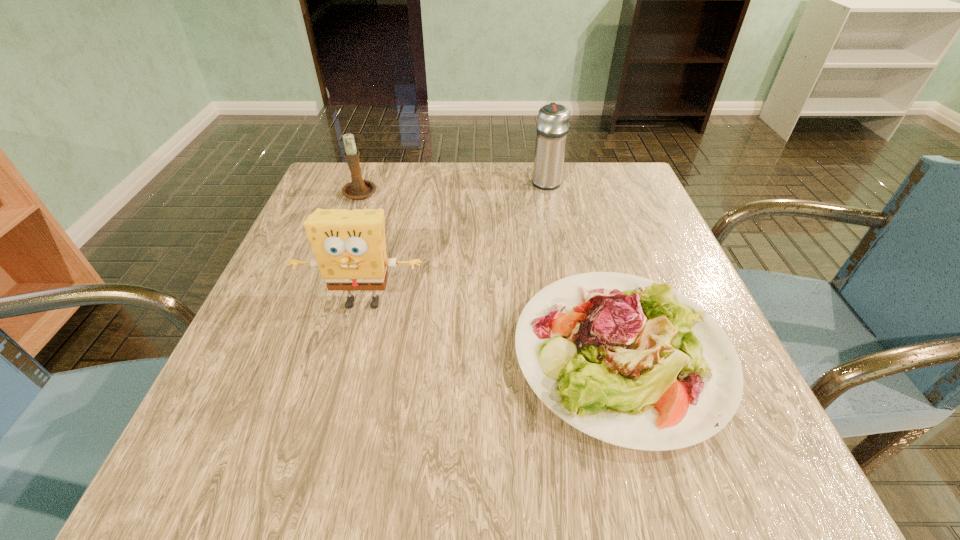
Where is `candle holder that is at the far edge`? candle holder that is at the far edge is located at coordinates (357, 189).

Identify the location of object at the near edge. The image size is (960, 540). (632, 362).

Find the location of a particular element. This screenshot has height=540, width=960. sponge that is at the left edge is located at coordinates (349, 245).

What are the coordinates of `candle holder located at the left edge` in the screenshot? It's located at (357, 189).

Image resolution: width=960 pixels, height=540 pixels. What are the coordinates of `object located in the right edge section of the desktop` in the screenshot? It's located at (632, 362).

I want to click on object positioned at the far left corner, so click(x=357, y=189).

Locate an element on the screen. object at the near right corner is located at coordinates (632, 362).

Locate an element on the screen. blank area at the far edge is located at coordinates (457, 165).

Find the location of a particular element. vacant area at the near edge is located at coordinates (438, 478).

What are the coordinates of `free space at the right edge of the desktop` in the screenshot? It's located at click(x=618, y=216).